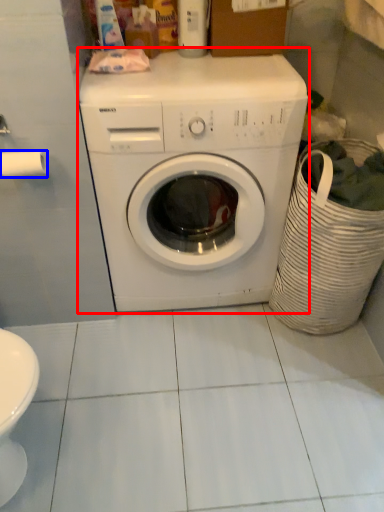
Question: Which object appears closest to the camera in this image, washing machine (highlighted by a red box) or toilet paper (highlighted by a blue box)?

Choices:
 (A) washing machine
 (B) toilet paper

Answer: (A)